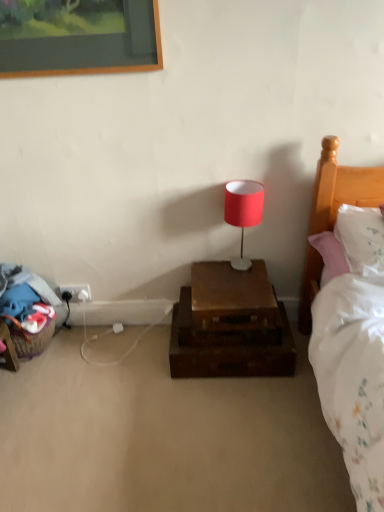
You are a GUI agent. You are given a task and a screenshot of the screen. Output one action in this format:
    pyautogui.click(x=<x>, y=<y>)
    Task: Click on the free point above matte red lampshade at center (from a real-world perspective)
    
    Given the screenshot: What is the action you would take?
    pyautogui.click(x=244, y=181)